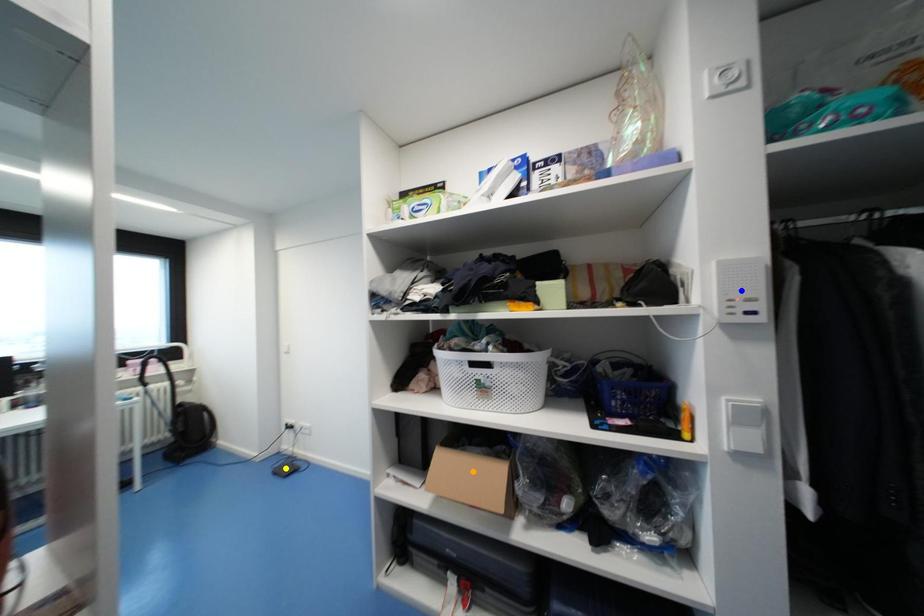
Order these from nearest to farthest:
A) orange point
B) blue point
C) yellow point

blue point
orange point
yellow point